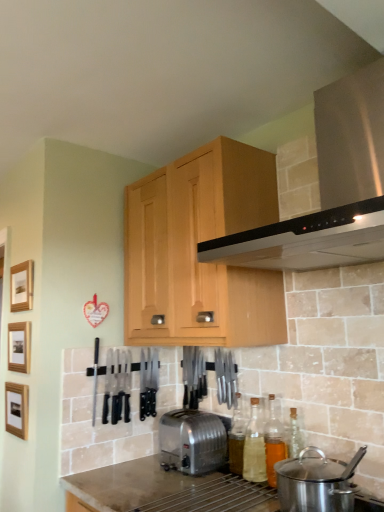
Question: From the image's perspective, is wooden picture frame at left, the 1th picture frame ordered from the bottom, above or below stainless steel range hood at upper center?

Choices:
 (A) above
 (B) below

Answer: (B)

Question: Is wooden picture frame at left, arranged as the third picture frame when viewed from the top, inside the boundaries of stainless steel range hood at upper center, or outside?

Choices:
 (A) inside
 (B) outside

Answer: (B)

Question: Which is nearer to the clear glass bottle at lower right, acting as the second bottle starting from the right?

Choices:
 (A) translucent glass bottle at center, the 1th bottle when ordered from right to left
 (B) wooden picture frame at left, the 3th picture frame ordered from the bottom
 (C) stainless steel range hood at upper center
 (D) translucent glass bottle at center, the first bottle in the left-to-right sequence
 (E) satin silver toaster at center

Answer: (A)

Question: Which is nearer to the wooden picture frame at left, the 1th picture frame ordered from the bottom?

Choices:
 (A) stainless steel range hood at upper center
 (B) translucent glass bottle at center, acting as the third bottle starting from the left
 (C) wooden picture frame at left, acting as the 2th picture frame starting from the top
 (D) clear glass bottle at lower right, acting as the second bottle starting from the right
 (E) light wood cabinet at upper center

Answer: (C)